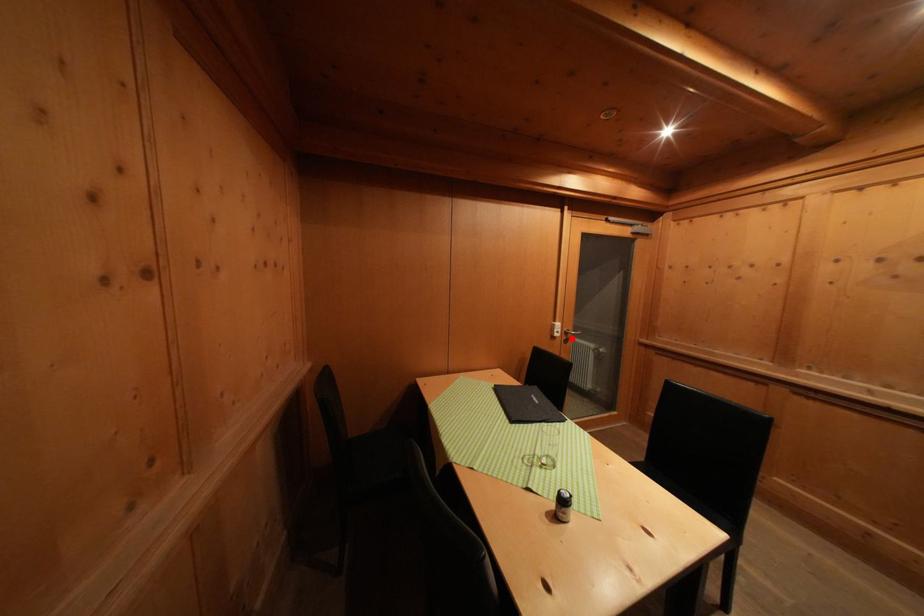
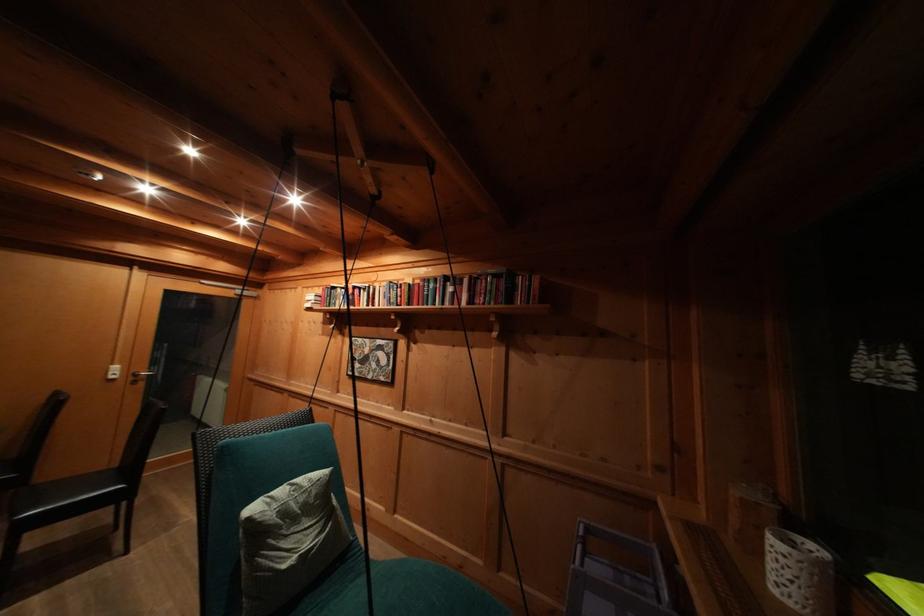
Question: I am providing you with two images of the same scene from different viewpoints. In image1, a red point is highlighted. Considering the same 3D point in image2, which of the following is correct?

Choices:
 (A) It is closer
 (B) It is farther

Answer: (A)